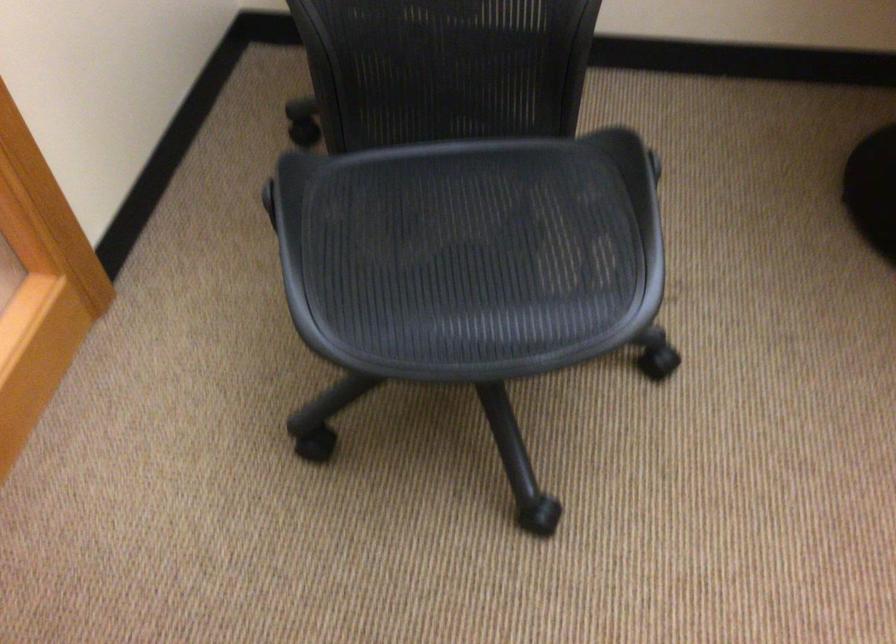
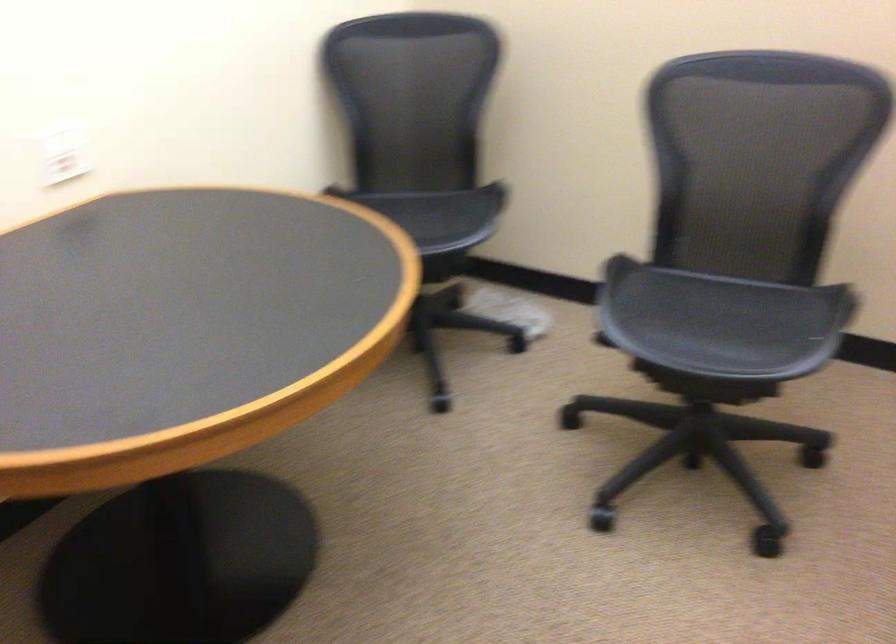
Question: The images are taken continuously from a first-person perspective. In which direction is your viewpoint rotating?

Choices:
 (A) Left
 (B) Right
 (C) Up
 (D) Down

Answer: (B)